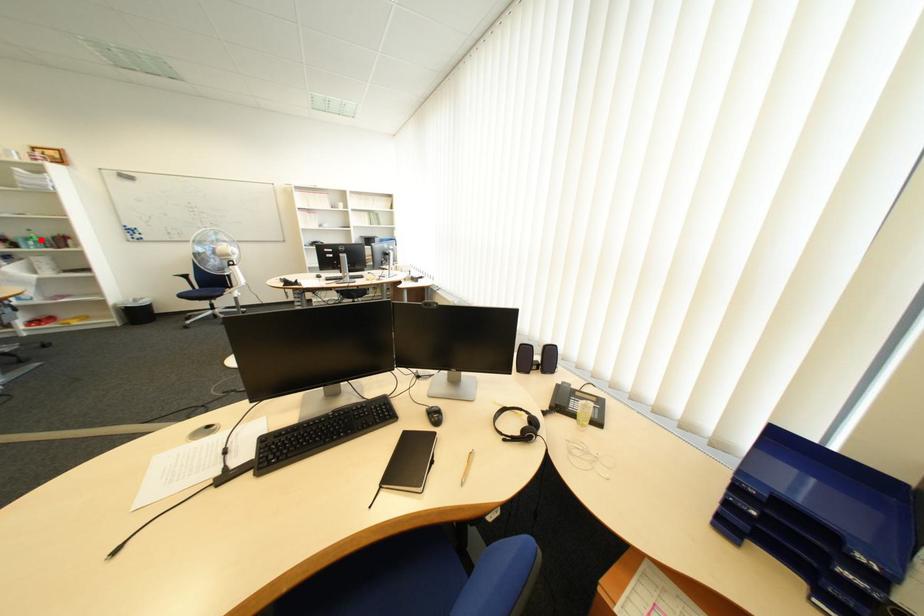
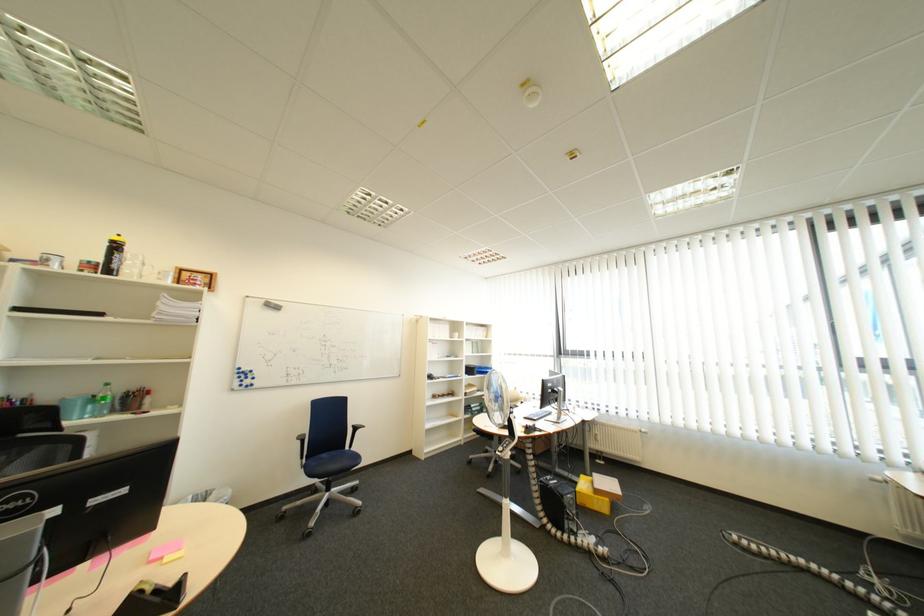
Question: I am providing you with two images of the same scene from different viewpoints. Image1 has a red point marked. In image2, the corresponding 3D location appears at what relative position? Reply with the corresponding letter.

Choices:
 (A) Closer
 (B) Farther

Answer: (A)